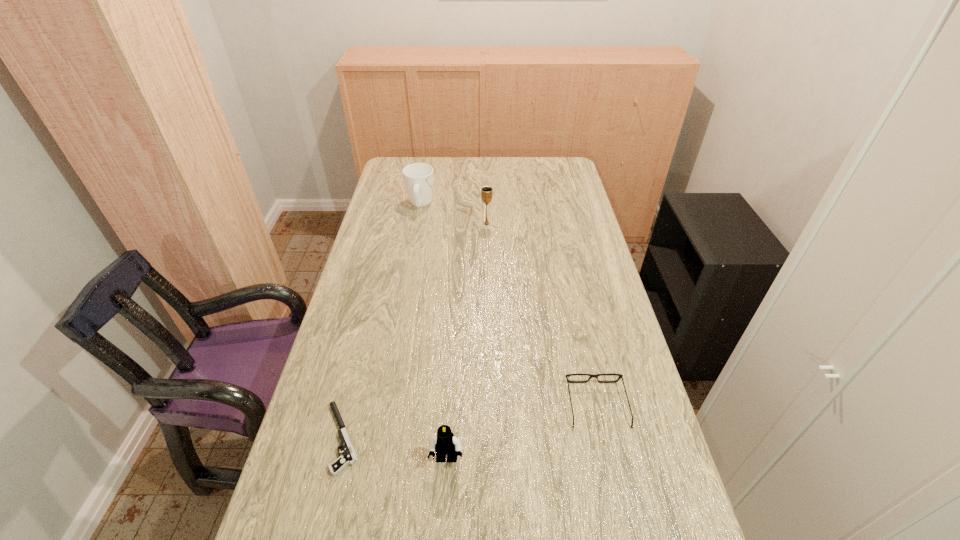
The image size is (960, 540). Find the location of `the fourth nearest object`. the fourth nearest object is located at coordinates (486, 192).

This screenshot has width=960, height=540. I want to click on chalice, so [x=486, y=192].

You are a GUI agent. You are given a task and a screenshot of the screen. Output one action in this format:
    pyautogui.click(x=<x>, y=<y>)
    Task: Click on the farthest object
    
    Given the screenshot: What is the action you would take?
    pyautogui.click(x=418, y=177)

Image resolution: width=960 pixels, height=540 pixels. What are the coordinates of `the third object from right to left` in the screenshot? It's located at (445, 443).

The image size is (960, 540). In order to click on the third shortest object in this screenshot , I will do `click(445, 443)`.

At what (x,y) coordinates should I click in order to perform the action: click on spectacles. Please return your answer as a coordinate pair (x, y). Looking at the image, I should click on (608, 374).

Identify the location of the rightmost object. (608, 374).

Locate an element on the screen. pistol is located at coordinates (349, 457).

Identify the location of free space located on the back of the chalice. (486, 197).

The image size is (960, 540). What are the coordinates of `vacant space located on the side of the mug with the handle` in the screenshot? It's located at click(425, 177).